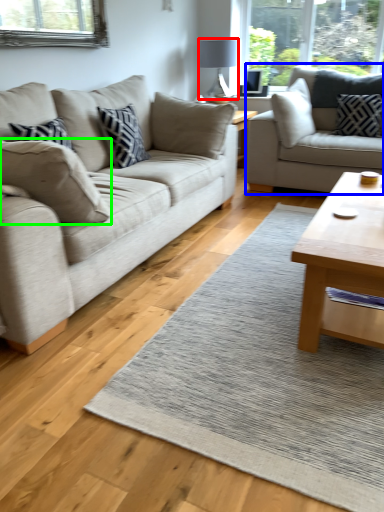
Question: Which is farther away from lamp (highlighted by a red box)? studio couch (highlighted by a blue box) or pillow (highlighted by a green box)?

Choices:
 (A) studio couch
 (B) pillow

Answer: (B)